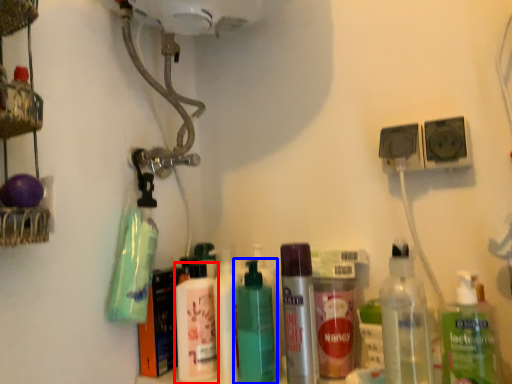
Question: Which of the following is the farthest to the observer, bottle (highlighted by a red box) or bottle (highlighted by a blue box)?

Choices:
 (A) bottle
 (B) bottle

Answer: (A)